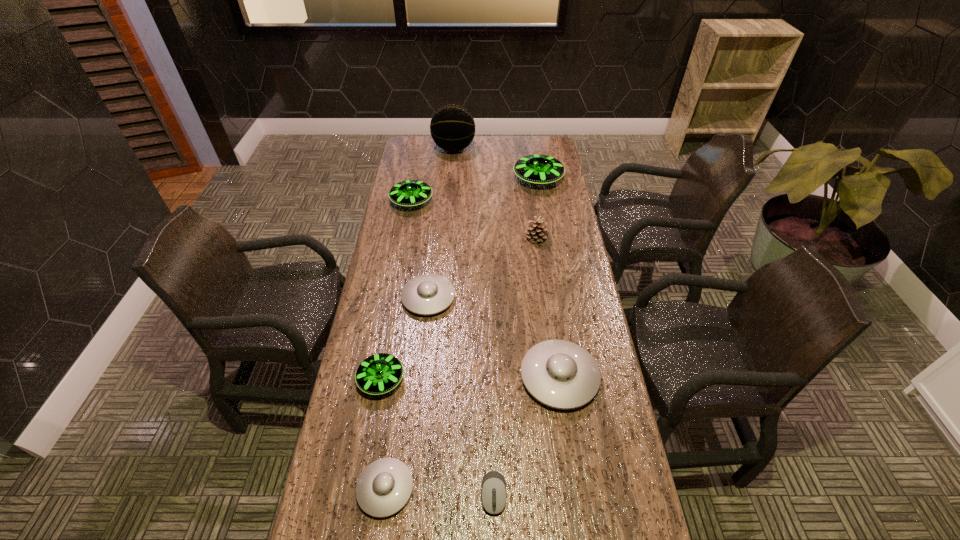
This screenshot has width=960, height=540. Identify the location of vacant area that lies between the nearest green saucer and the second biggest green saucer. (396, 291).

Where is `vacant area that lies between the biggest gray saucer and the fifth nearest object`? vacant area that lies between the biggest gray saucer and the fifth nearest object is located at coordinates (493, 338).

Find the location of a particular element. object that is the eighth closest one to the farthest object is located at coordinates (493, 489).

Identify the location of object that is the sixth closest to the shortest object. (409, 193).

Identify which saucer is the closest to the nearest saucer. Please provide its 2D coordinates. Your answer should be formatted as a tuple, i.e. [(x, y)], where the tuple contains the x and y coordinates of a point satisfying the conditions above.

[(380, 373)]

What are the coordinates of `saucer that is the fifth nearest to the rightmost green saucer` in the screenshot? It's located at (384, 487).

Point out which green saucer is positioned as the third nearest to the biggest gray saucer. Please provide its 2D coordinates. Your answer should be formatted as a tuple, i.e. [(x, y)], where the tuple contains the x and y coordinates of a point satisfying the conditions above.

[(537, 169)]

Identify which green saucer is located as the second nearest to the second smallest green saucer. Please provide its 2D coordinates. Your answer should be formatted as a tuple, i.e. [(x, y)], where the tuple contains the x and y coordinates of a point satisfying the conditions above.

[(380, 373)]

Locate which gray saucer is the second closest to the sixth object from left to right. Please provide its 2D coordinates. Your answer should be formatted as a tuple, i.e. [(x, y)], where the tuple contains the x and y coordinates of a point satisfying the conditions above.

[(560, 374)]

Where is `gray saucer object that ranks as the closest to the tallest saucer`? gray saucer object that ranks as the closest to the tallest saucer is located at coordinates (428, 294).